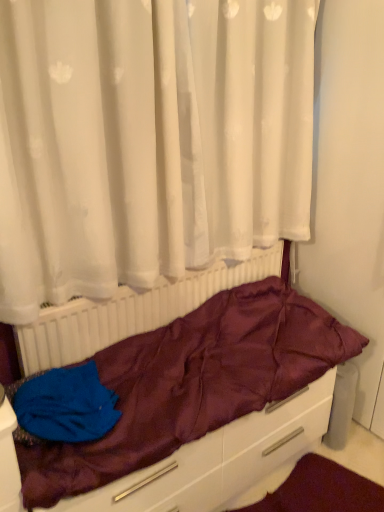
Describe the element at coordinates (237, 419) in the screenshot. I see `maroon satin sleeping bag at center` at that location.

The width and height of the screenshot is (384, 512). I want to click on blue fabric at lower left, so click(x=63, y=406).

Find the location of a particular element. white plastic radiator at center is located at coordinates [x=131, y=311].

Is white plastic radiator at center inside white sheer curtain at upper center?

Actually, white plastic radiator at center is outside white sheer curtain at upper center.

Between white sheer curtain at upper center and white plastic radiator at center, which one has smaller width?

Thinner between the two is white plastic radiator at center.

Which point is more distant from viewer, (x=16, y=116) or (x=306, y=330)?

Point (x=306, y=330)

Would you consider white sheer curtain at upper center to be distant from maroon satin sleeping bag at center?

white sheer curtain at upper center is near maroon satin sleeping bag at center, not far away.

Considering the sizes of white sheer curtain at upper center and maroon satin sleeping bag at center in the image, is white sheer curtain at upper center wider or thinner than maroon satin sleeping bag at center?

In the image, white sheer curtain at upper center appears to be more narrow than maroon satin sleeping bag at center.

Is maroon satin sleeping bag at center bigger or smaller than white plastic radiator at center?

Clearly, maroon satin sleeping bag at center is larger in size than white plastic radiator at center.

Looking at this image, is maroon satin sleeping bag at center thinner than white plastic radiator at center?

Incorrect, the width of maroon satin sleeping bag at center is not less than that of white plastic radiator at center.

From a real-world perspective, is maroon satin sleeping bag at center over white plastic radiator at center?

No, from a real-world perspective, maroon satin sleeping bag at center is not over white plastic radiator at center

Can you confirm if maroon satin sleeping bag at center is taller than white plastic radiator at center?

Incorrect, the height of maroon satin sleeping bag at center is not larger of that of white plastic radiator at center.

Is white plastic radiator at center in contact with blue fabric at lower left?

No, white plastic radiator at center is not touching blue fabric at lower left.

Considering the relative positions of white plastic radiator at center and blue fabric at lower left in the image provided, is white plastic radiator at center to the right of blue fabric at lower left from the viewer's perspective?

Yes, white plastic radiator at center is to the right of blue fabric at lower left.

Is blue fabric at lower left spatially inside white plastic radiator at center, or outside of it?

blue fabric at lower left is not inside white plastic radiator at center, it's outside.

From a real-world perspective, is blue fabric at lower left under white plastic radiator at center?

Yes, from a real-world perspective, blue fabric at lower left is beneath white plastic radiator at center.

Can you confirm if blue fabric at lower left is smaller than white plastic radiator at center?

Indeed, blue fabric at lower left has a smaller size compared to white plastic radiator at center.

Between blue fabric at lower left and white plastic radiator at center, which one is positioned behind?

white plastic radiator at center is further away from the camera.

Considering their positions, is blue fabric at lower left located in front of or behind maroon satin sleeping bag at center?

blue fabric at lower left is positioned farther from the viewer than maroon satin sleeping bag at center.

From the image's perspective, would you say blue fabric at lower left is positioned over maroon satin sleeping bag at center?

No, from the image's perspective, blue fabric at lower left is not over maroon satin sleeping bag at center.

Does point (55, 369) lie behind point (243, 294)?

No, (55, 369) is closer to viewer.

Looking at this image, is white sheer curtain at upper center aimed at blue fabric at lower left?

No, white sheer curtain at upper center does not turn towards blue fabric at lower left.

Find the location of `curtain that appears above the blue fabric at lower left (from the image's perspective)`. curtain that appears above the blue fabric at lower left (from the image's perspective) is located at coordinates (147, 140).

Is white sheer curtain at upper center positioned far away from blue fabric at lower left?

white sheer curtain at upper center is near blue fabric at lower left, not far away.

How different are the orientations of white sheer curtain at upper center and blue fabric at lower left in degrees?

3.05 degrees separate the facing orientations of white sheer curtain at upper center and blue fabric at lower left.

Image resolution: width=384 pixels, height=512 pixels. In order to click on radiator below the white sheer curtain at upper center (from the image's perspective) in this screenshot , I will do `click(131, 311)`.

The height and width of the screenshot is (512, 384). I want to click on furniture that appears on the right of white sheer curtain at upper center, so click(237, 419).

Looking at the image, which one is located closer to maroon satin sleeping bag at center, blue fabric at lower left or white sheer curtain at upper center?

blue fabric at lower left is positioned closer to the anchor maroon satin sleeping bag at center.

Looking at the image, which one is located closer to white sheer curtain at upper center, white plastic radiator at center or maroon satin sleeping bag at center?

Among the two, white plastic radiator at center is located nearer to white sheer curtain at upper center.

When comparing their distances from white sheer curtain at upper center, does blue fabric at lower left or maroon satin sleeping bag at center seem further?

The object further to white sheer curtain at upper center is blue fabric at lower left.

Which object lies nearer to the anchor point white sheer curtain at upper center, blue fabric at lower left or white plastic radiator at center?

white plastic radiator at center.

Considering their positions, is blue fabric at lower left positioned closer to maroon satin sleeping bag at center than white plastic radiator at center?

Among the two, white plastic radiator at center is located nearer to maroon satin sleeping bag at center.

Which object lies further to the anchor point blue fabric at lower left, white sheer curtain at upper center or maroon satin sleeping bag at center?

Based on the image, white sheer curtain at upper center appears to be further to blue fabric at lower left.

Estimate the real-world distances between objects in this image. Which object is closer to white plastic radiator at center, white sheer curtain at upper center or blue fabric at lower left?

blue fabric at lower left lies closer to white plastic radiator at center than the other object.

When comparing their distances from maroon satin sleeping bag at center, does white plastic radiator at center or white sheer curtain at upper center seem further?

white sheer curtain at upper center is positioned further to the anchor maroon satin sleeping bag at center.

Locate an element on the screen. This screenshot has width=384, height=512. radiator between blue fabric at lower left and maroon satin sleeping bag at center is located at coordinates (131, 311).

Find the location of a particular element. The width and height of the screenshot is (384, 512). radiator between white sheer curtain at upper center and blue fabric at lower left from top to bottom is located at coordinates (131, 311).

Where is `furniture between white sheer curtain at upper center and blue fabric at lower left in the up-down direction`? furniture between white sheer curtain at upper center and blue fabric at lower left in the up-down direction is located at coordinates (237, 419).

Where is `radiator between white sheer curtain at upper center and maroon satin sleeping bag at center from top to bottom`? The image size is (384, 512). radiator between white sheer curtain at upper center and maroon satin sleeping bag at center from top to bottom is located at coordinates (131, 311).